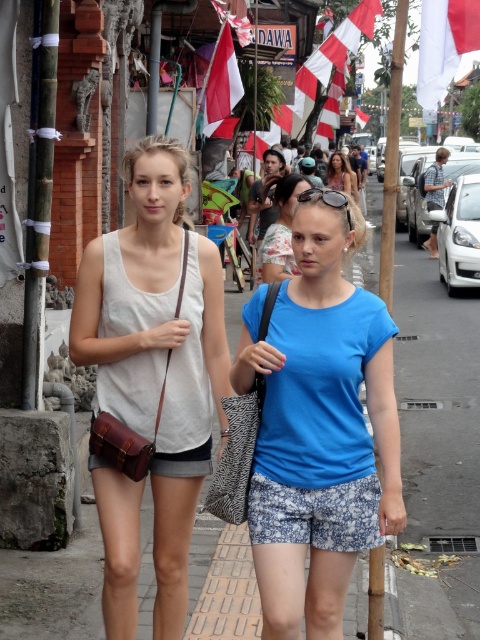
Is floral fabric blouse at center positioned before matte blue shirt at center?

Yes.

Is floral fabric blouse at center thinner than matte blue shirt at center?

Indeed, floral fabric blouse at center has a lesser width compared to matte blue shirt at center.

Is point (271, 257) farther from camera compared to point (347, 177)?

No, it is in front of (347, 177).

Where is `floral fabric blouse at center`? The width and height of the screenshot is (480, 640). floral fabric blouse at center is located at coordinates (280, 228).

Between white fabric flag at upper center and white and red fabric flag at upper center, which one appears on the left side from the viewer's perspective?

Positioned to the left is white and red fabric flag at upper center.

Is point (479, 1) closer to viewer compared to point (240, 97)?

Yes, it is.

This screenshot has height=640, width=480. I want to click on white fabric flag at upper center, so click(x=444, y=44).

Can you confirm if white matte tank top at center is thinner than matte blue shirt at center?

In fact, white matte tank top at center might be wider than matte blue shirt at center.

Describe the element at coordinates (157, 352) in the screenshot. I see `white matte tank top at center` at that location.

You are a GUI agent. You are given a task and a screenshot of the screen. Output one action in this format:
    pyautogui.click(x=<x>, y=<y>)
    Task: Click on the white matte tank top at center
    Image resolution: width=480 pixels, height=640 pixels.
    Given the screenshot: What is the action you would take?
    pyautogui.click(x=157, y=352)